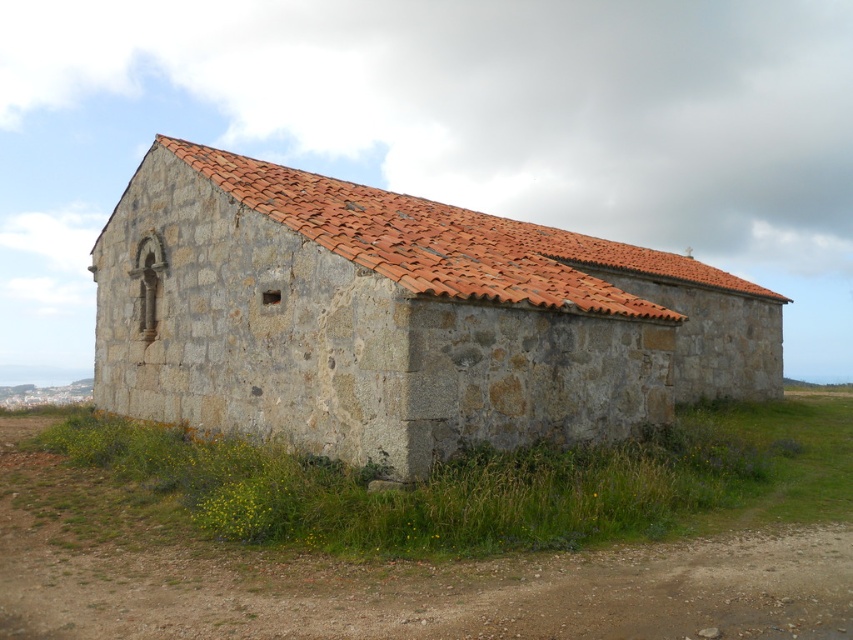
Question: Which point is farther to the camera?

Choices:
 (A) (24, 518)
 (B) (363, 211)
 (C) (587, 282)

Answer: (C)

Question: Which of the following is the closest to the observer?

Choices:
 (A) (271, 177)
 (B) (392, 269)

Answer: (B)

Question: Is stone textured barn at center wider than green grass at lower right?

Choices:
 (A) no
 (B) yes

Answer: (B)

Question: Which of the following is the closest to the observer?

Choices:
 (A) green grass at lower right
 (B) red clay tiles at upper center
 (C) stone textured barn at center

Answer: (A)

Question: Does green grass at lower right have a smaller size compared to red clay tiles at upper center?

Choices:
 (A) yes
 (B) no

Answer: (A)

Question: Can you confirm if green grass at lower right is positioned to the right of red clay tiles at upper center?

Choices:
 (A) no
 (B) yes

Answer: (A)